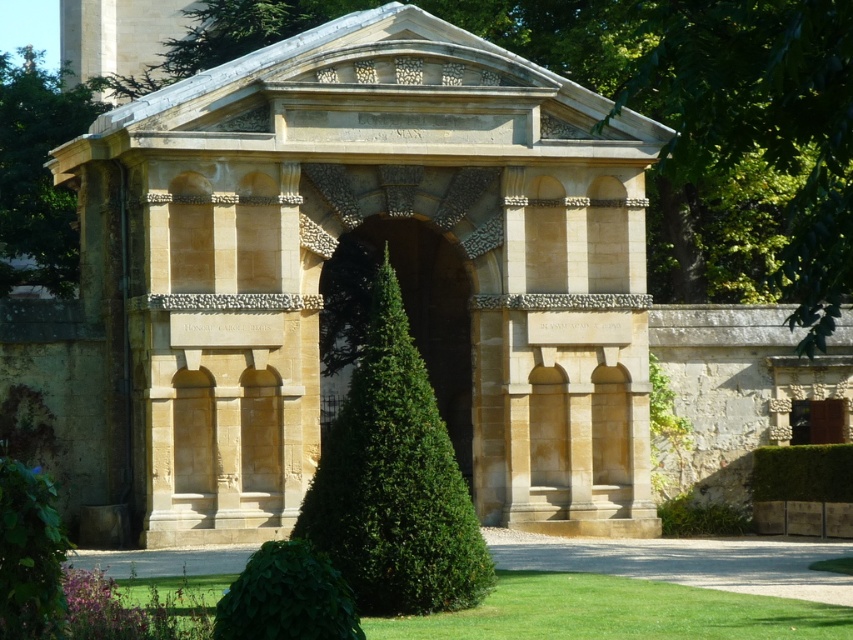
You are standing in front of the classical stone structure and notice two green leafy plants. One is the green leafy bush at center and the other is the green leafy hedge at lower center. Which one is closer to you?

The green leafy bush at center is closer to you because it is further to the viewer than the green leafy hedge at lower center.

You are a gardener planning to trim both the green leafy bush at center and the green leafy hedge at lower center. Based on their widths, which one requires more time to trim? Please explain your reasoning.

The green leafy bush at center requires more time to trim because its width is larger than the green leafy hedge at lower center, meaning it has more foliage to manage.